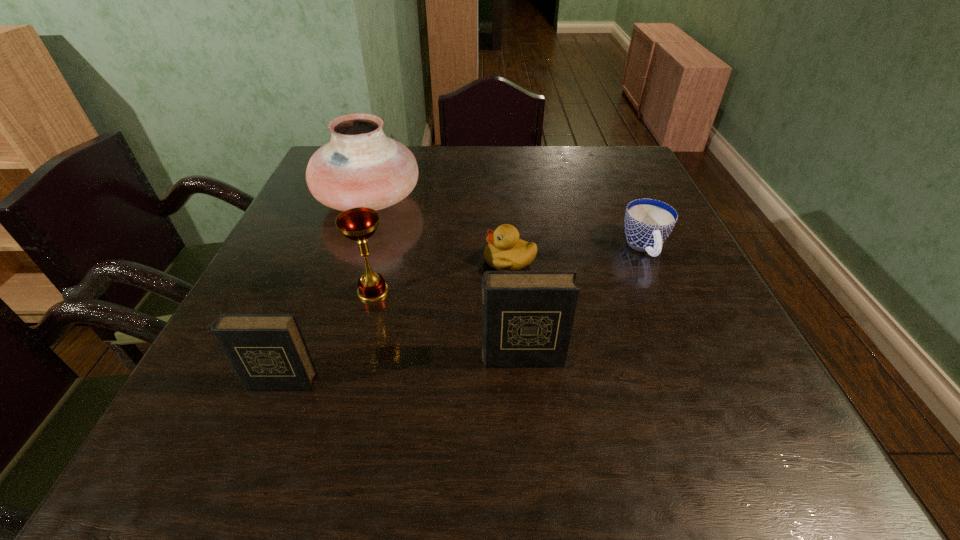
Image resolution: width=960 pixels, height=540 pixels. I want to click on free area in between the duckling and the pottery, so click(x=440, y=231).

You are a GUI agent. You are given a task and a screenshot of the screen. Output one action in this format:
    pyautogui.click(x=<x>, y=<y>)
    Task: Click on the free space that is in between the nearer diary and the duckling
    This screenshot has width=960, height=540.
    Given the screenshot: What is the action you would take?
    pyautogui.click(x=396, y=321)

This screenshot has height=540, width=960. In order to click on free point between the pottery and the rightmost object in this screenshot , I will do `click(507, 224)`.

Find the location of `free space that is in between the chalice and the duckling`. free space that is in between the chalice and the duckling is located at coordinates (442, 276).

At what (x,y) coordinates should I click in order to perform the action: click on object that is the closest one to the fourth farthest object. Please return your answer as a coordinate pair (x, y). Looking at the image, I should click on (268, 351).

The width and height of the screenshot is (960, 540). Find the location of `object that is the third closest to the pottery`. object that is the third closest to the pottery is located at coordinates (527, 316).

This screenshot has height=540, width=960. Identify the location of vacant space that satisfies the following two spatial constraints: 1. on the front-facing side of the duckling; 2. on the front cover of the nearest object. (519, 382).